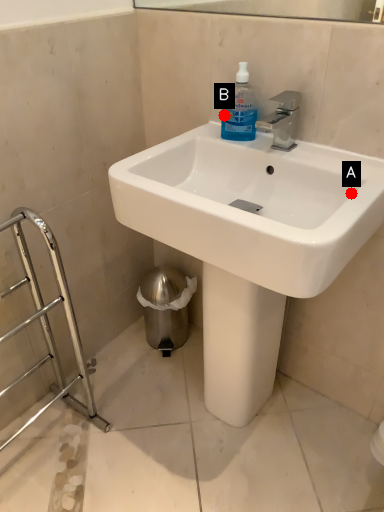
Question: Two points are circled on the image, labeled by A and B beside each circle. Which point is farther to the camera?

Choices:
 (A) A is further
 (B) B is further

Answer: (B)